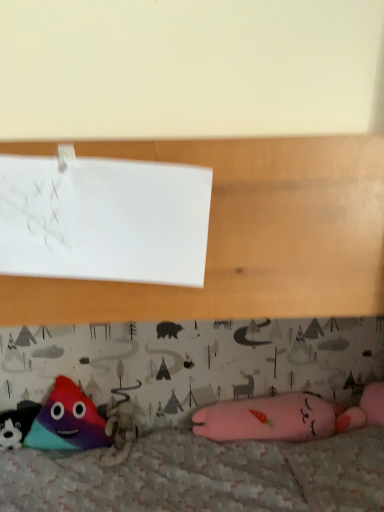
Question: Is multicolored plush toy at lower left, positioned as the 1th toy in left-to-right order, surrounded by white paper at upper left?

Choices:
 (A) no
 (B) yes

Answer: (A)

Question: From the image's perspective, is white paper at upper left under multicolored plush toy at lower left, the third toy positioned from the right?

Choices:
 (A) yes
 (B) no

Answer: (B)

Question: From a real-world perspective, is white paper at upper left located higher than multicolored plush toy at lower left, positioned as the 1th toy in left-to-right order?

Choices:
 (A) yes
 (B) no

Answer: (A)

Question: Could you tell me if white paper at upper left is facing multicolored plush toy at lower left, the third toy positioned from the right?

Choices:
 (A) no
 (B) yes

Answer: (A)

Question: Can you confirm if white paper at upper left is wider than multicolored plush toy at lower left, positioned as the 1th toy in left-to-right order?

Choices:
 (A) yes
 (B) no

Answer: (B)

Question: Is multicolored plush triangle at lower left, arranged as the second toy when viewed from the right, wider or thinner than white paper at upper left?

Choices:
 (A) thin
 (B) wide

Answer: (B)

Question: Considering the positions of multicolored plush triangle at lower left, arranged as the second toy when viewed from the right, and white paper at upper left in the image, is multicolored plush triangle at lower left, arranged as the second toy when viewed from the right, taller or shorter than white paper at upper left?

Choices:
 (A) tall
 (B) short

Answer: (A)

Question: Is point tap(72, 438) closer or farther from the camera than point tap(178, 253)?

Choices:
 (A) farther
 (B) closer

Answer: (A)

Question: Based on their sizes in the image, would you say multicolored plush triangle at lower left, arranged as the second toy when viewed from the right, is bigger or smaller than white paper at upper left?

Choices:
 (A) small
 (B) big

Answer: (B)

Question: Based on their positions, is white paper at upper left located to the left or right of multicolored plush triangle at lower left, which ranks as the second toy in left-to-right order?

Choices:
 (A) right
 (B) left

Answer: (A)

Question: From a real-world perspective, is white paper at upper left positioned above or below multicolored plush triangle at lower left, which ranks as the second toy in left-to-right order?

Choices:
 (A) above
 (B) below

Answer: (A)

Question: Is white paper at upper left wider or thinner than multicolored plush triangle at lower left, which ranks as the second toy in left-to-right order?

Choices:
 (A) thin
 (B) wide

Answer: (A)

Question: Looking at the image, does white paper at upper left seem bigger or smaller compared to multicolored plush triangle at lower left, arranged as the second toy when viewed from the right?

Choices:
 (A) small
 (B) big

Answer: (A)

Question: Is multicolored plush triangle at lower left, arranged as the second toy when viewed from the right, bigger or smaller than pink plush toy at lower right, positioned as the 1th toy in right-to-left order?

Choices:
 (A) small
 (B) big

Answer: (A)

Question: Visually, is multicolored plush triangle at lower left, which ranks as the second toy in left-to-right order, positioned to the left or to the right of pink plush toy at lower right, the third toy when ordered from left to right?

Choices:
 (A) left
 (B) right

Answer: (A)